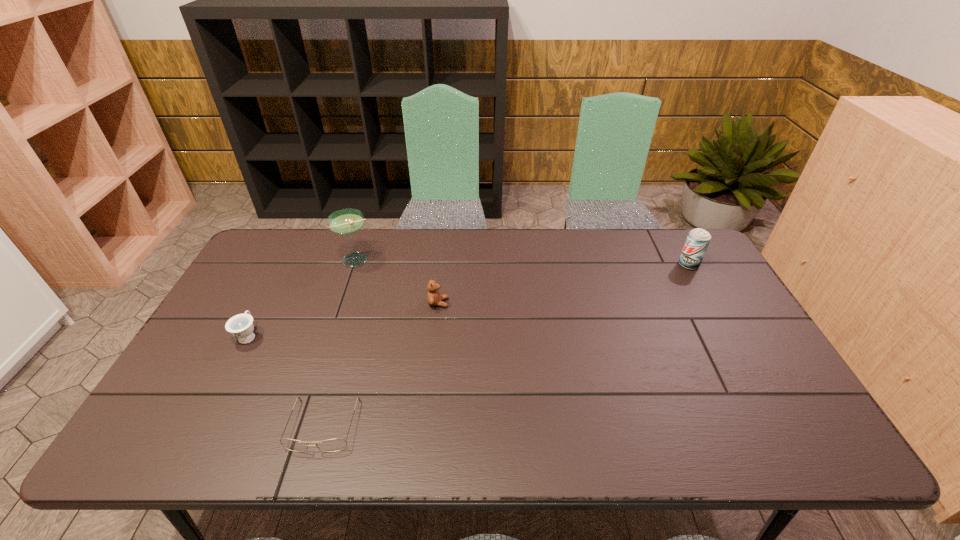
Locate an element on the screen. The width and height of the screenshot is (960, 540). free space in the image that satisfies the following two spatial constraints: 1. on the face of the teddy bear; 2. on the front-facing side of the nearest object is located at coordinates (425, 425).

Where is `vacant space that satisfies the following two spatial constraints: 1. on the face of the teddy bear; 2. on the front-facing side of the spectacles`? Image resolution: width=960 pixels, height=540 pixels. vacant space that satisfies the following two spatial constraints: 1. on the face of the teddy bear; 2. on the front-facing side of the spectacles is located at coordinates (425, 425).

Locate an element on the screen. The width and height of the screenshot is (960, 540). vacant area that satisfies the following two spatial constraints: 1. on the side of the leftmost object with the handle; 2. on the left side of the fourth shortest object is located at coordinates (285, 265).